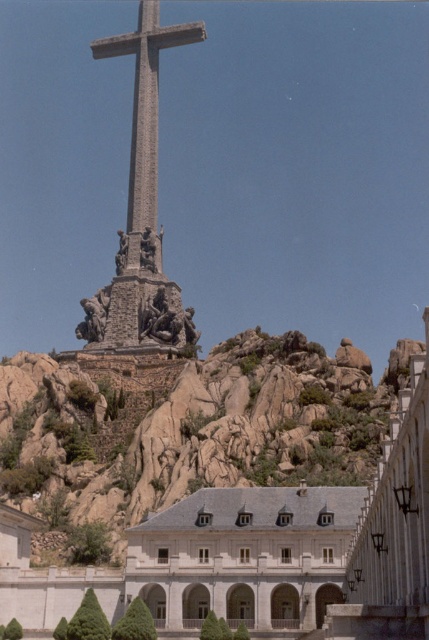
You are standing at the base of the monumental cross and want to reach the point marked by point (257, 406). However, there is an obstacle at point (141, 45). Will you encounter this obstacle on your way?

Since point (257, 406) is in front of point (141, 45), you will not encounter the obstacle at point (141, 45) on your way to point (257, 406).

You are a tourist standing at the base of the hill. You want to take a photo of the stone cross at center while also including the white stone building at lower left in the frame. Considering their sizes, will you need to zoom in or zoom out to capture both in the shot?

The white stone building at lower left is bigger than the stone cross at center, so to include both in the frame, you would need to zoom out to accommodate the larger size of the white stone building at lower left.